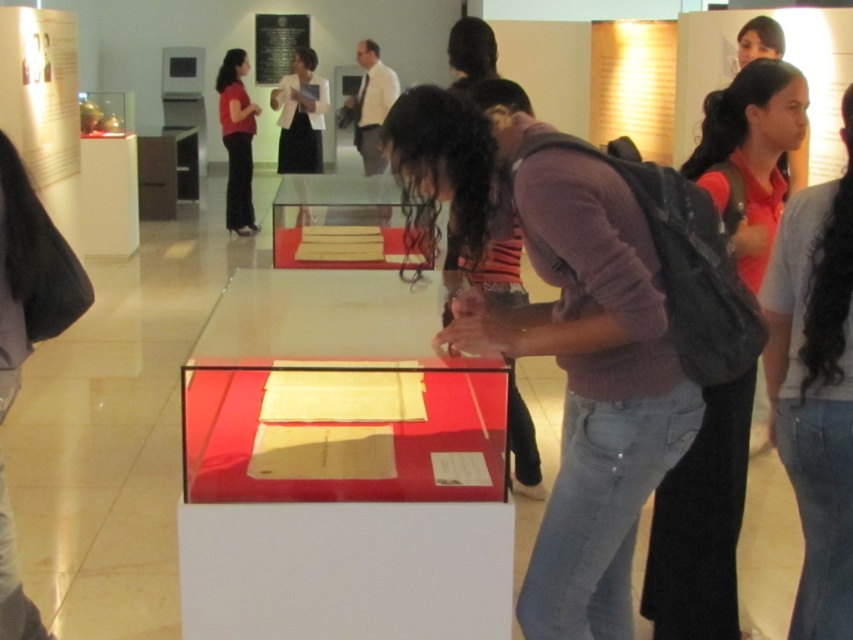
Does matte gray shirt at right have a smaller size compared to matte black backpack at center?

Correct, matte gray shirt at right occupies less space than matte black backpack at center.

Between matte gray shirt at right and matte black backpack at center, which one appears on the left side from the viewer's perspective?

matte black backpack at center is more to the left.

Measure the distance between point (x=842, y=280) and camera.

1.80 meters

Locate an element on the screen. This screenshot has width=853, height=640. matte gray shirt at right is located at coordinates (815, 388).

Where is `red shirt at center`? The height and width of the screenshot is (640, 853). red shirt at center is located at coordinates (701, 524).

Consider the image. Does red shirt at center appear under matte red dress at upper left?

Correct, red shirt at center is located below matte red dress at upper left.

Locate an element on the screen. The height and width of the screenshot is (640, 853). red shirt at center is located at coordinates (701, 524).

This screenshot has height=640, width=853. Identify the location of red shirt at center. (701, 524).

Is matte purple sweater at center to the right of matte black backpack at center from the viewer's perspective?

Correct, you'll find matte purple sweater at center to the right of matte black backpack at center.

Who is positioned more to the left, matte purple sweater at center or matte black backpack at center?

Positioned to the left is matte black backpack at center.

Is point (564, 637) less distant than point (479, 172)?

No, it is behind (479, 172).

I want to click on matte purple sweater at center, so click(x=583, y=369).